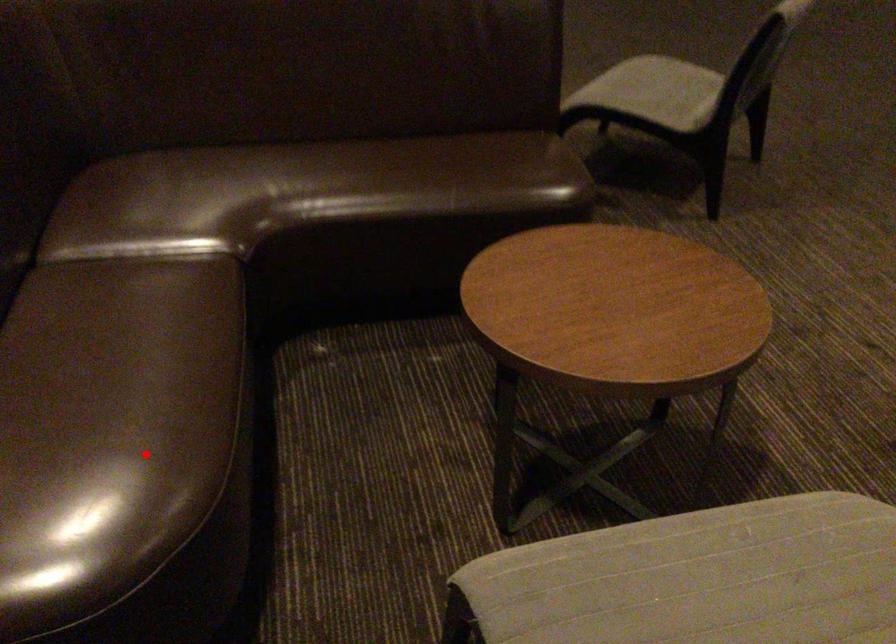
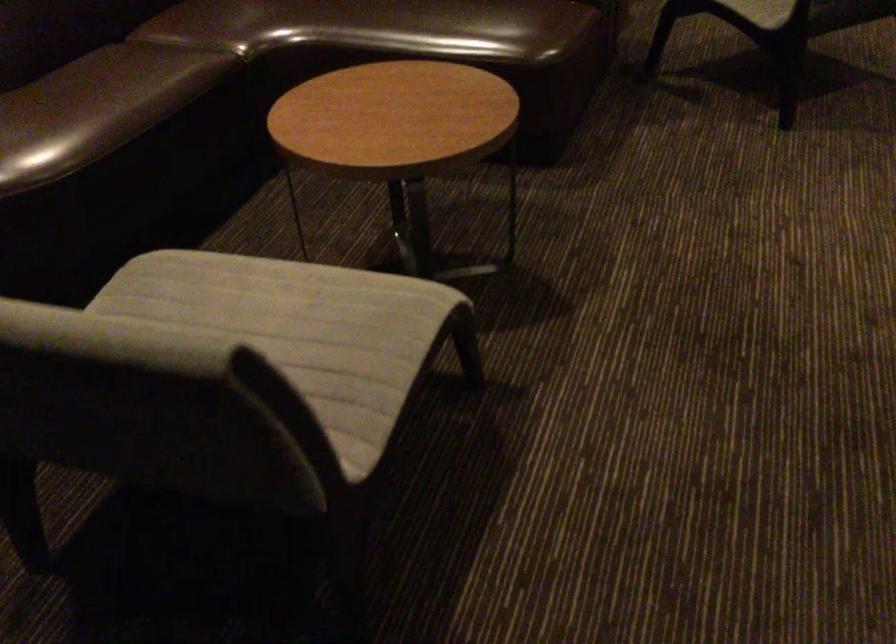
Find the pixel in the second image that matches the highlighted location in the first image.

(42, 138)